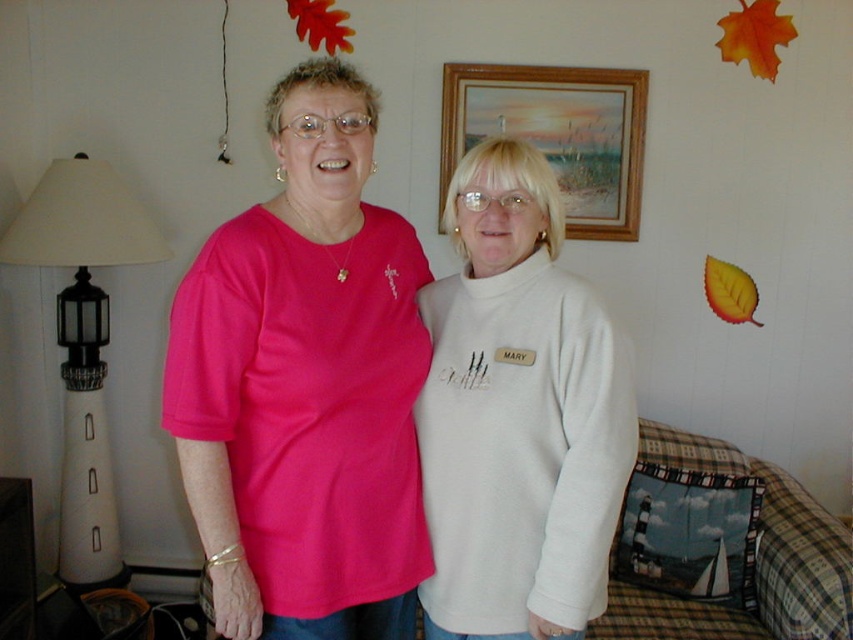
Does matte pink shirt at center have a greater width compared to white matte lighthouse at left?

Yes.

Is matte pink shirt at center positioned at the back of white matte lighthouse at left?

No.

I want to click on matte pink shirt at center, so click(x=305, y=385).

Is white matte lighthouse at left to the left of wooden frame at upper center from the viewer's perspective?

Correct, you'll find white matte lighthouse at left to the left of wooden frame at upper center.

How far apart are white matte lighthouse at left and wooden frame at upper center?

white matte lighthouse at left and wooden frame at upper center are 1.36 meters apart from each other.

This screenshot has height=640, width=853. I want to click on white matte lighthouse at left, so click(83, 342).

This screenshot has width=853, height=640. In order to click on matte pink shirt at center in this screenshot , I will do `click(305, 385)`.

Does matte pink shirt at center have a greater width compared to white fleece sweater at center?

Indeed, matte pink shirt at center has a greater width compared to white fleece sweater at center.

The width and height of the screenshot is (853, 640). What are the coordinates of `matte pink shirt at center` in the screenshot? It's located at (305, 385).

I want to click on matte pink shirt at center, so tap(305, 385).